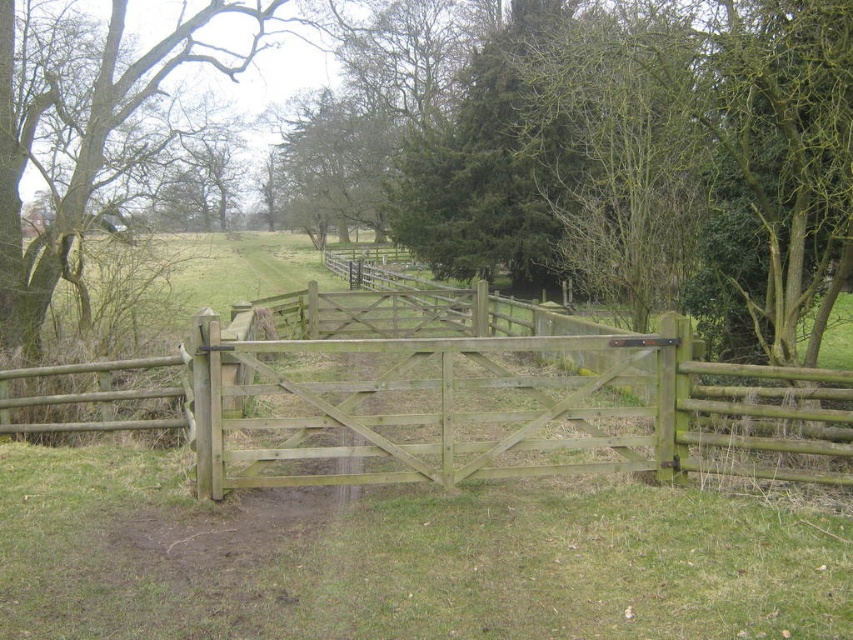
Question: Which point appears closest to the camera in this image?

Choices:
 (A) (380, 353)
 (B) (144, 68)

Answer: (A)

Question: Does light brown wooden gate at center appear under green wood tree at center?

Choices:
 (A) yes
 (B) no

Answer: (A)

Question: Can you confirm if light brown wooden gate at center is positioned to the right of green wood tree at center?

Choices:
 (A) no
 (B) yes

Answer: (B)

Question: Is light brown wooden gate at center to the left of green wood tree at center from the viewer's perspective?

Choices:
 (A) no
 (B) yes

Answer: (A)

Question: Which object is farther from the camera taking this photo?

Choices:
 (A) light brown wooden gate at center
 (B) green wood tree at center

Answer: (B)